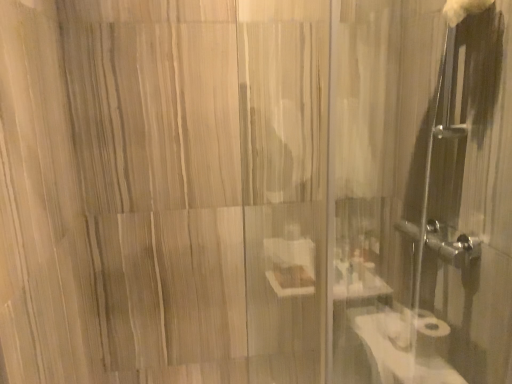
Image resolution: width=512 pixels, height=384 pixels. What do you see at coordinates (423, 196) in the screenshot? I see `clear plastic screen door at right` at bounding box center [423, 196].

I want to click on clear plastic screen door at right, so click(x=423, y=196).

In order to click on clear plastic screen door at right in this screenshot , I will do `click(423, 196)`.